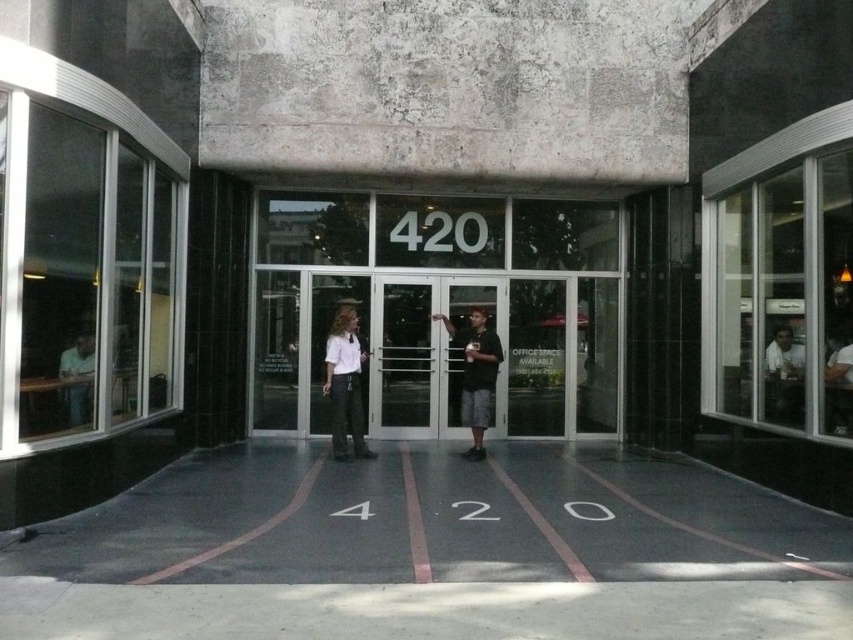
You are at the entrance of the building and need to find the person wearing the matte white shirt at center. According to the scene description, where exactly is this person positioned relative to the entrance?

The matte white shirt at center is located at point 0.586 on the horizontal axis and 0.559 on the vertical axis relative to the entrance.

You are a delivery person with a cart that is 1.2 meters wide. You need to pass through the entrance between the white shirt at center and the light brown wood chair at right. Can your cart fit through the space between them?

The white shirt at center might be wider than light brown wood chair at right, so the space between them may not be wide enough for the cart that is 1.2 meters wide. It is uncertain if the cart can fit through the space between the white shirt at center and the light brown wood chair at right.